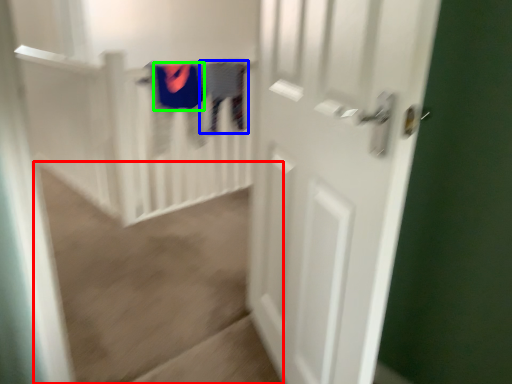
Question: Estimate the real-world distances between objects in this image. Which object is farther from plain (highlighted by a red box), clothing (highlighted by a blue box) or clothing (highlighted by a green box)?

Choices:
 (A) clothing
 (B) clothing

Answer: (A)